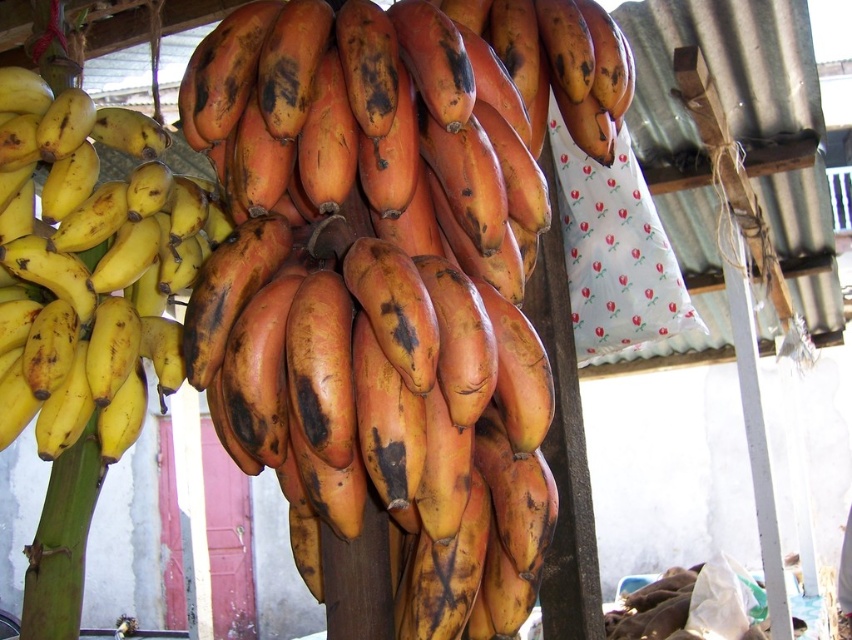
You are a customer at the market stall looking at the bananas. You want to buy bananas that are slightly ripe but not overripe. Which bananas should you choose between the ripe brown bananas at center and the yellow matte bananas at left?

The yellow matte bananas at left are less ripe than the ripe brown bananas at center, so you should choose the yellow matte bananas at left.

You are standing at the market stall and want to pick up the two points mentioned. Which point is closer to you, point (258,40) or point (173,220)?

Point (258,40) is in front of point (173,220), so it is closer to you.